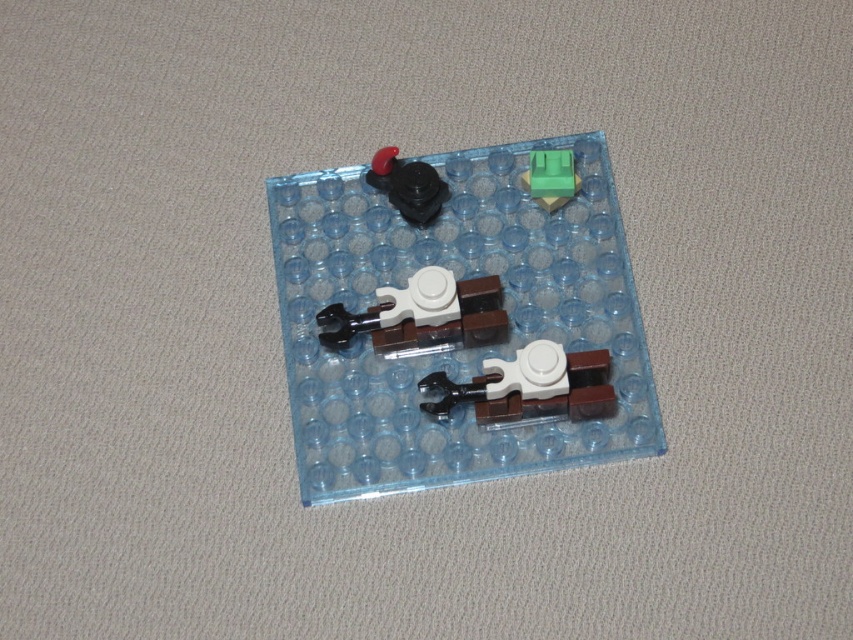
Question: Which point is farther from the camera taking this photo?

Choices:
 (A) (527, 172)
 (B) (486, 317)
 (C) (328, 240)
 (D) (402, 179)

Answer: (C)

Question: Does brown plastic train at center appear under green plastic block at upper right?

Choices:
 (A) no
 (B) yes

Answer: (B)

Question: Does brown plastic train at center have a greater width compared to brown matte/brick-like at center?

Choices:
 (A) yes
 (B) no

Answer: (A)

Question: Which object is positioned farthest from the brown plastic train at center?

Choices:
 (A) brown matte/texture brick at center
 (B) brown matte/brick-like at center

Answer: (A)

Question: Considering the real-world distances, which object is farthest from the brown plastic train at center?

Choices:
 (A) brown matte/brick-like at center
 (B) brown matte/texture brick at center
 (C) matte black gear at upper left
 (D) green plastic block at upper right

Answer: (D)

Question: Does matte black gear at upper left appear on the right side of green plastic block at upper right?

Choices:
 (A) no
 (B) yes

Answer: (A)